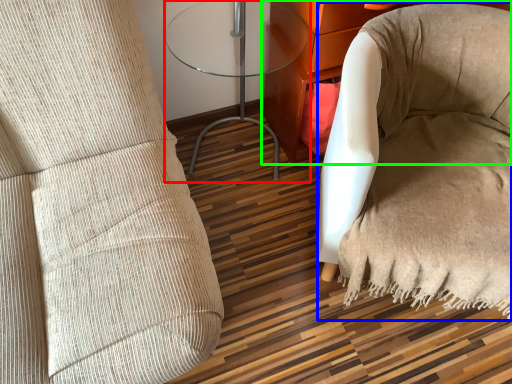
Question: Based on their relative distances, which object is nearer to table (highlighted by a red box)? Choose from bean bag chair (highlighted by a blue box) and furniture (highlighted by a green box).

Choices:
 (A) bean bag chair
 (B) furniture

Answer: (B)